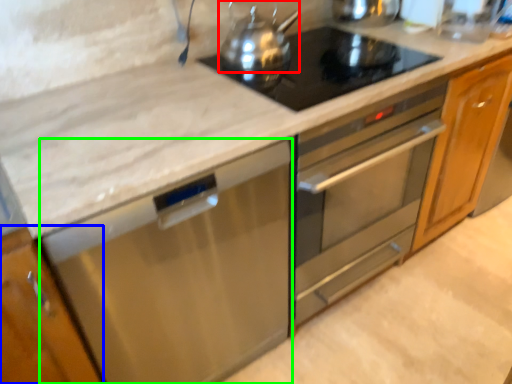
Question: Which is farther away from kitchen appliance (highlighted by a red box)? cabinetry (highlighted by a blue box) or dish washer (highlighted by a green box)?

Choices:
 (A) cabinetry
 (B) dish washer

Answer: (A)